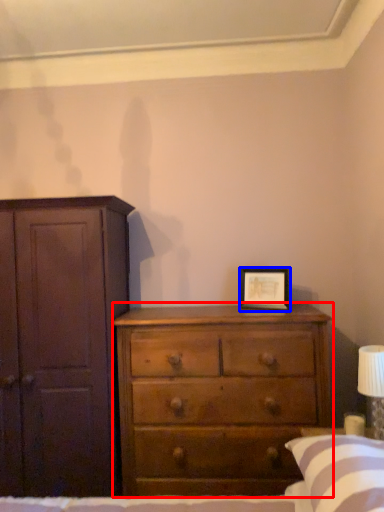
Question: Among these objects, which one is farthest to the camera, chest of drawers (highlighted by a red box) or picture frame (highlighted by a blue box)?

Choices:
 (A) chest of drawers
 (B) picture frame

Answer: (B)